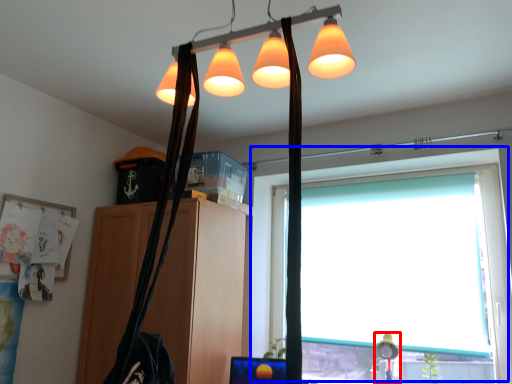
Question: Among these objects, which one is farthest to the camera, table lamp (highlighted by a red box) or window (highlighted by a blue box)?

Choices:
 (A) table lamp
 (B) window

Answer: (A)